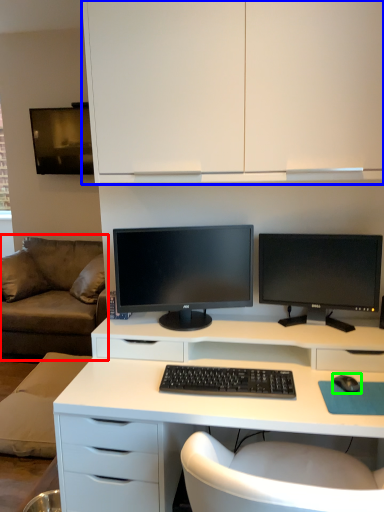
Question: Which is farther away from studio couch (highlighted by a red box)? cabinetry (highlighted by a blue box) or mouse (highlighted by a green box)?

Choices:
 (A) cabinetry
 (B) mouse

Answer: (B)